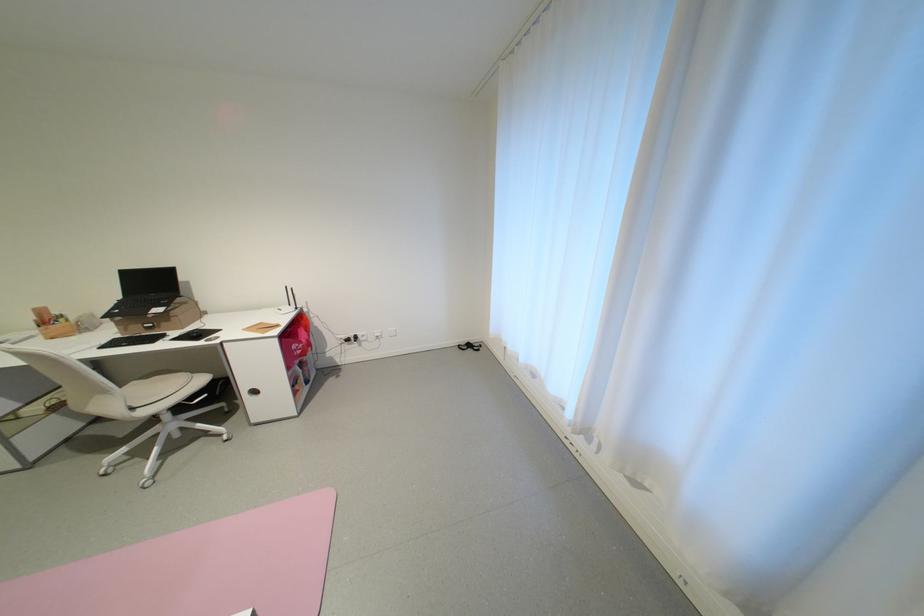
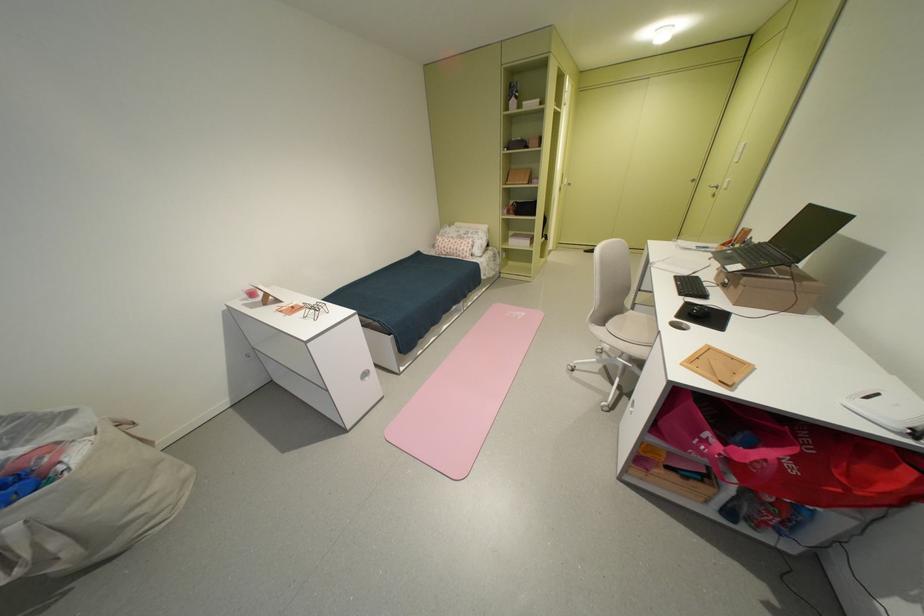
In the second image, find the point that corresponds to (146,408) in the first image.

(615, 326)